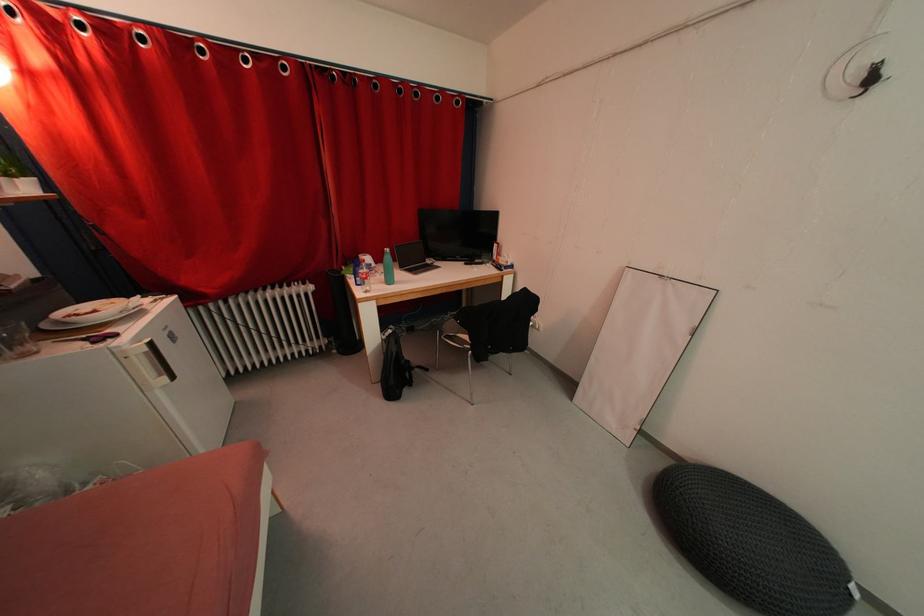
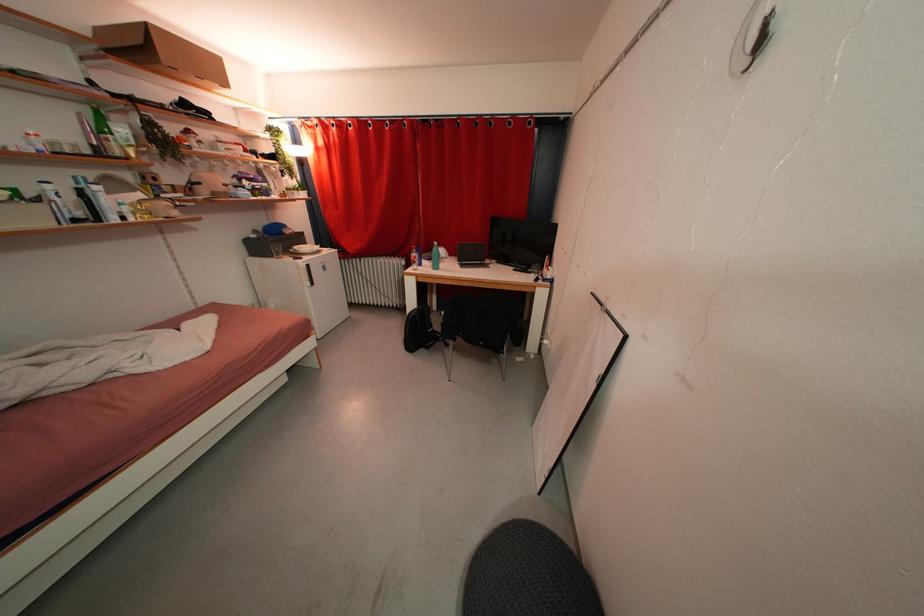
In the second image, find the point that corresponds to (x=512, y=272) in the first image.

(551, 284)